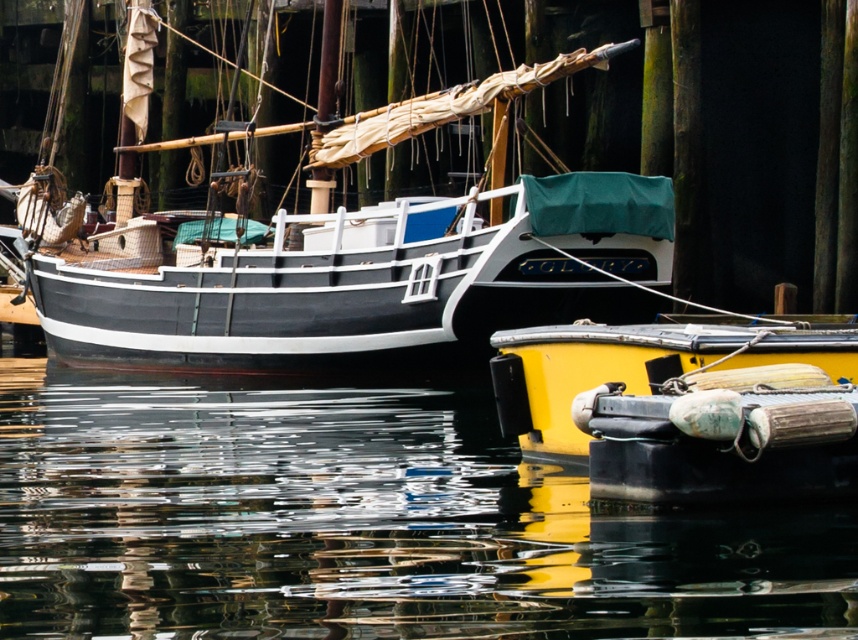
Question: Is matte black sailboat at upper left wider than yellow matte buoy at lower right?

Choices:
 (A) no
 (B) yes

Answer: (B)

Question: Among these objects, which one is farthest from the camera?

Choices:
 (A) glossy water at lower center
 (B) yellow matte buoy at lower right
 (C) matte black sailboat at upper left

Answer: (C)

Question: Among these objects, which one is farthest from the camera?

Choices:
 (A) yellow matte buoy at lower right
 (B) matte black sailboat at upper left
 (C) glossy water at lower center

Answer: (B)

Question: Is glossy water at lower center positioned behind matte black sailboat at upper left?

Choices:
 (A) yes
 (B) no

Answer: (B)

Question: Which object appears farthest from the camera in this image?

Choices:
 (A) yellow matte buoy at lower right
 (B) glossy water at lower center
 (C) matte black sailboat at upper left

Answer: (C)

Question: Can you confirm if glossy water at lower center is positioned above matte black sailboat at upper left?

Choices:
 (A) yes
 (B) no

Answer: (B)